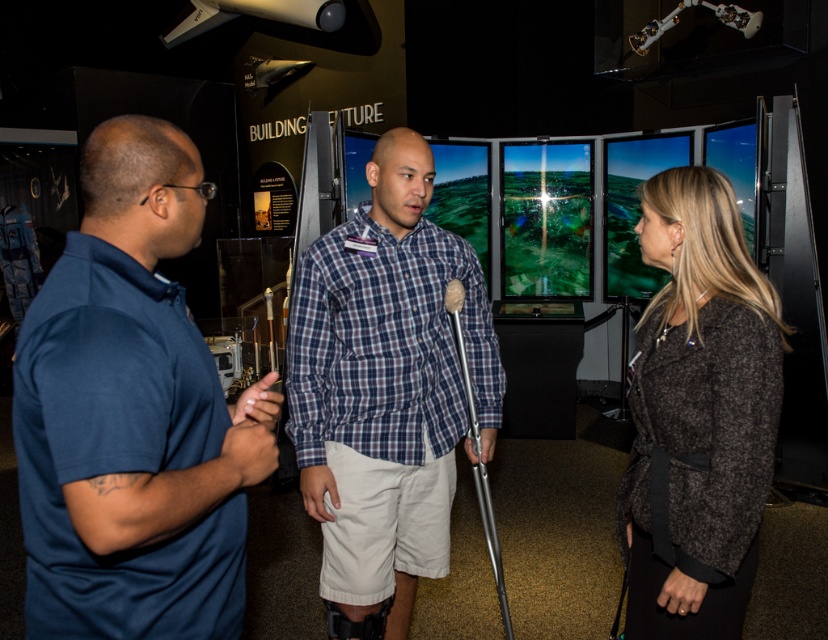
Based on the photo, you are a tour guide in the exhibition and need to direct a visitor to the exit, which is on the right side of the room. You see the blue cotton polo shirt at left and the blue plaid shirt at center. Which person should you approach to ask for help pointing the visitor to the exit?

You should approach the blue plaid shirt at center because they are closer to the center of the room, which is near the exit on the right side.

You are a tour guide at the museum and need to direct a visitor to the exit located behind the dark gray woolen jacket at center. The visitor is currently standing near the blue cotton polo shirt at left. Can you walk straight towards the exit without moving around any people?

The blue cotton polo shirt at left is in front of dark gray woolen jacket at center, so the visitor cannot walk straight to the exit behind the dark gray woolen jacket at center without moving around the person in the blue cotton polo shirt at left.

You are a security guard in the exhibition hall. You need to ensure that the blue plaid shirt at center and the silver metallic crutch at center can both fit through a doorway that is 1 meter wide. Can they pass through together?

The blue plaid shirt at center is wider than the silver metallic crutch at center. However, since the total width of both objects combined is not provided, it is uncertain if they can pass through the 1 meter wide doorway together. Additional information is needed to determine this.